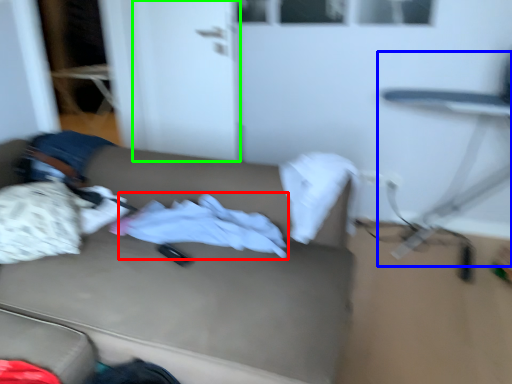
Question: Considering the real-world distances, which object is farthest from baby clothe (highlighted by a red box)? swivel chair (highlighted by a blue box) or door (highlighted by a green box)?

Choices:
 (A) swivel chair
 (B) door

Answer: (A)